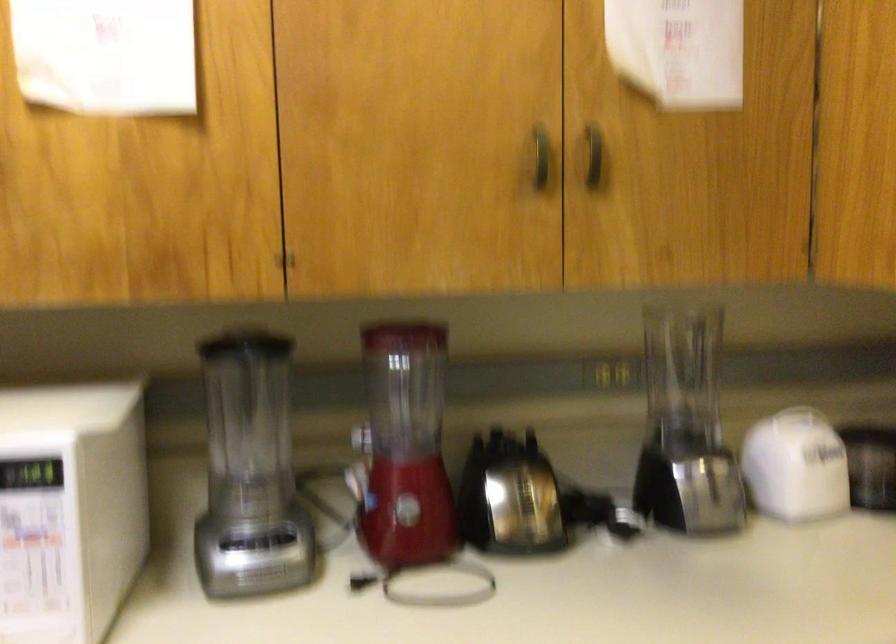
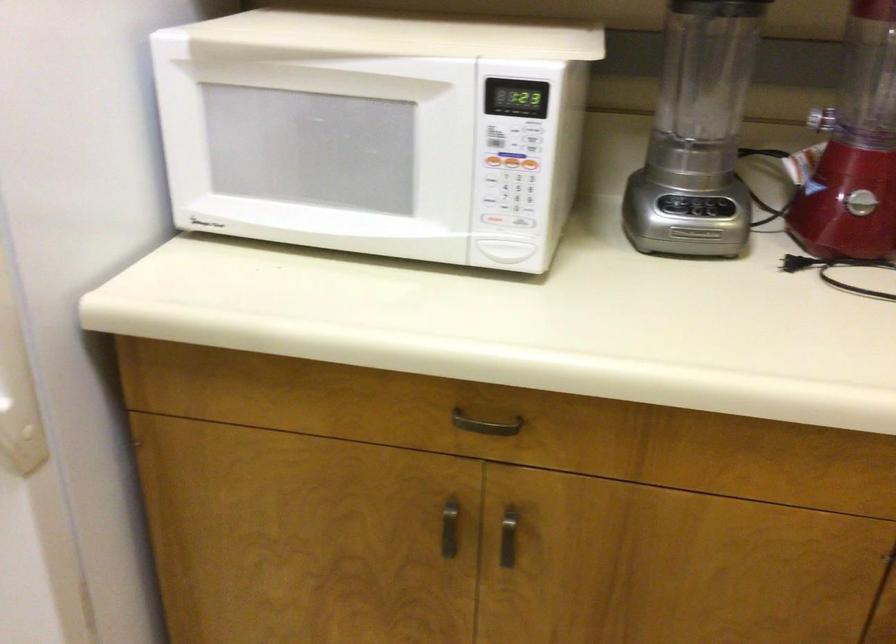
First-person continuous shooting, in which direction is the camera rotating?

The camera's rotation is toward left-down.